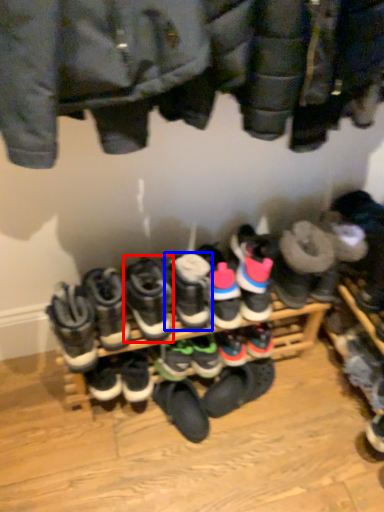
Question: Among these objects, which one is nearest to the camera, footwear (highlighted by a red box) or footwear (highlighted by a blue box)?

Choices:
 (A) footwear
 (B) footwear

Answer: (A)